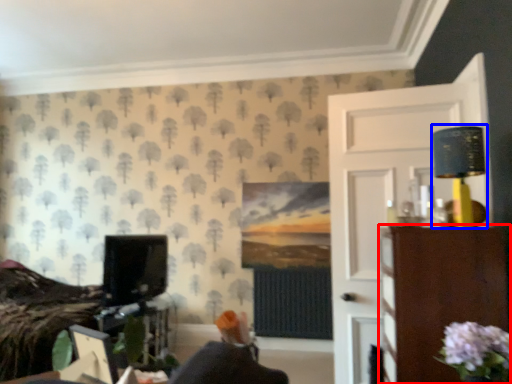
Question: Which object appears closest to the camera in this image, furniture (highlighted by a red box) or table lamp (highlighted by a blue box)?

Choices:
 (A) furniture
 (B) table lamp

Answer: (A)